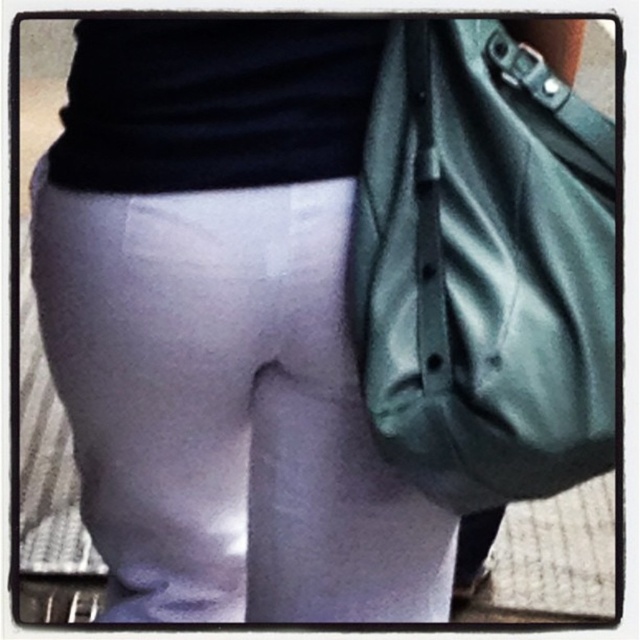
Question: Does matte white leggings at center have a greater width compared to matte green shoulder bag at right?

Choices:
 (A) yes
 (B) no

Answer: (A)

Question: Which of the following is the closest to the observer?

Choices:
 (A) (504, 424)
 (B) (300, 410)

Answer: (A)

Question: Observing the image, what is the correct spatial positioning of matte white leggings at center in reference to matte green shoulder bag at right?

Choices:
 (A) right
 (B) left

Answer: (B)

Question: Which point is farther to the camera?

Choices:
 (A) matte white leggings at center
 (B) matte green shoulder bag at right

Answer: (A)

Question: Does matte white leggings at center have a smaller size compared to matte green shoulder bag at right?

Choices:
 (A) yes
 (B) no

Answer: (B)